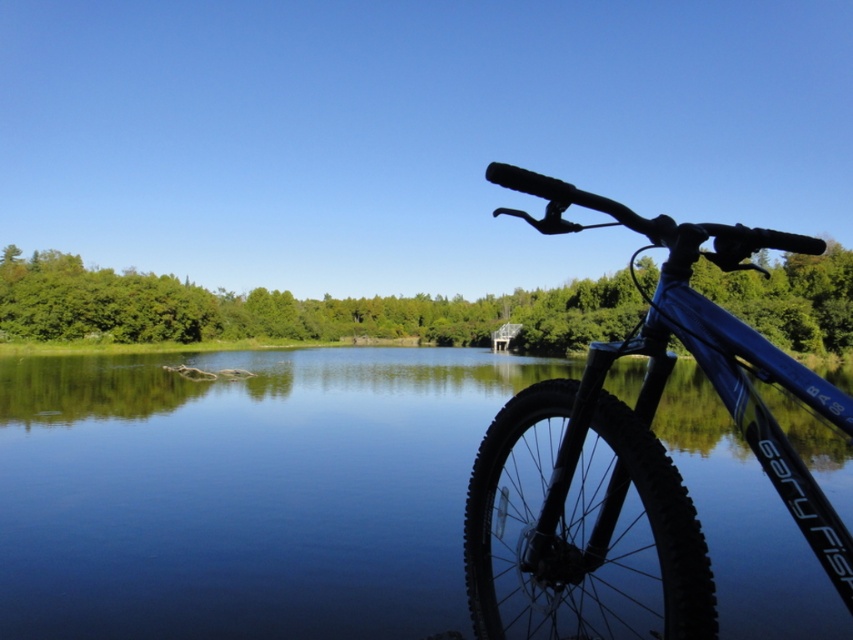
Question: Among these objects, which one is farthest from the camera?

Choices:
 (A) blue matte bicycle at right
 (B) glossy blue water at center

Answer: (B)

Question: Does glossy blue water at center have a lesser width compared to blue matte bicycle at right?

Choices:
 (A) yes
 (B) no

Answer: (B)

Question: Does glossy blue water at center appear under blue matte bicycle at right?

Choices:
 (A) no
 (B) yes

Answer: (B)

Question: Which of the following is the farthest from the observer?

Choices:
 (A) (675, 484)
 (B) (489, 365)

Answer: (B)

Question: Is glossy blue water at center bigger than blue matte bicycle at right?

Choices:
 (A) yes
 (B) no

Answer: (B)